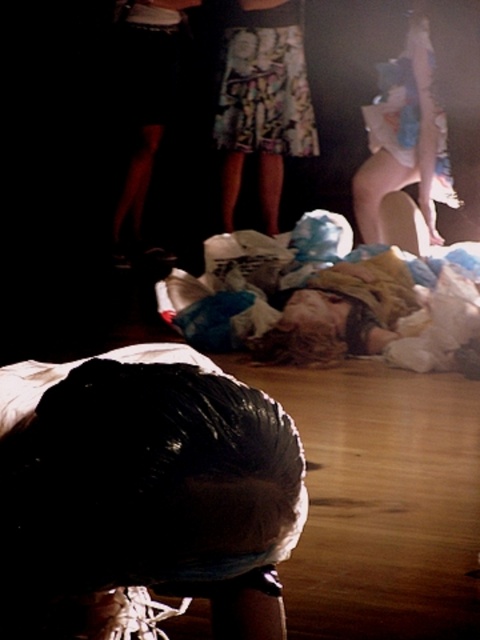
Question: Which point is farther from the camera taking this photo?

Choices:
 (A) (188, 451)
 (B) (264, 221)

Answer: (B)

Question: Among these points, which one is nearest to the camera?

Choices:
 (A) (304, 138)
 (B) (118, 474)

Answer: (B)

Question: Can you confirm if black matte hair at lower center is positioned to the right of printed fabric skirt at center?

Choices:
 (A) yes
 (B) no

Answer: (B)

Question: Among these points, which one is nearest to the camera?

Choices:
 (A) (283, 3)
 (B) (191, 356)

Answer: (B)

Question: Can you confirm if black matte hair at lower center is smaller than printed fabric skirt at center?

Choices:
 (A) no
 (B) yes

Answer: (B)

Question: Does black matte hair at lower center appear over printed fabric skirt at center?

Choices:
 (A) no
 (B) yes

Answer: (A)